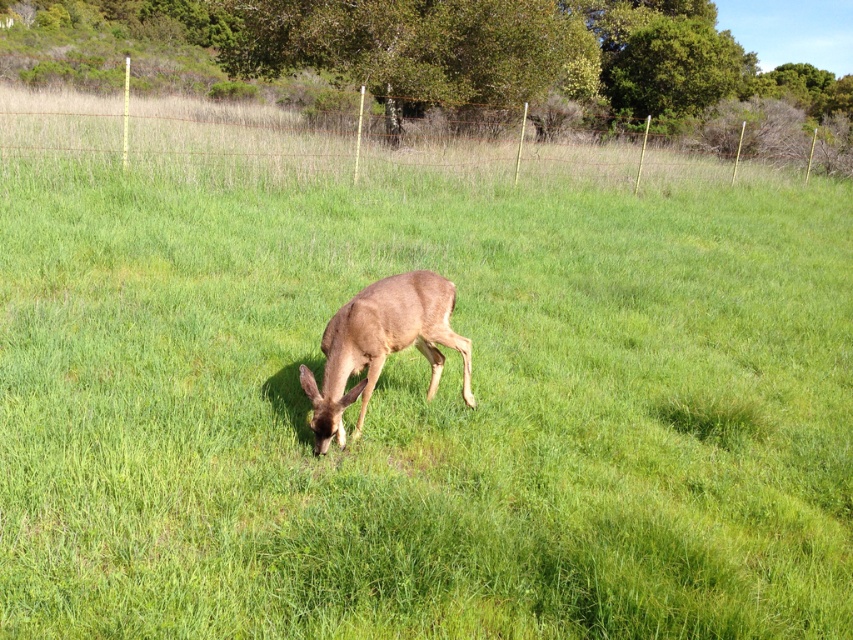
Can you confirm if brown wire fence at upper center is positioned to the right of brown matte deer at center?

Correct, you'll find brown wire fence at upper center to the right of brown matte deer at center.

Does point (184, 154) lie behind point (372, 355)?

Yes, it is.

Locate an element on the screen. The image size is (853, 640). brown wire fence at upper center is located at coordinates (235, 141).